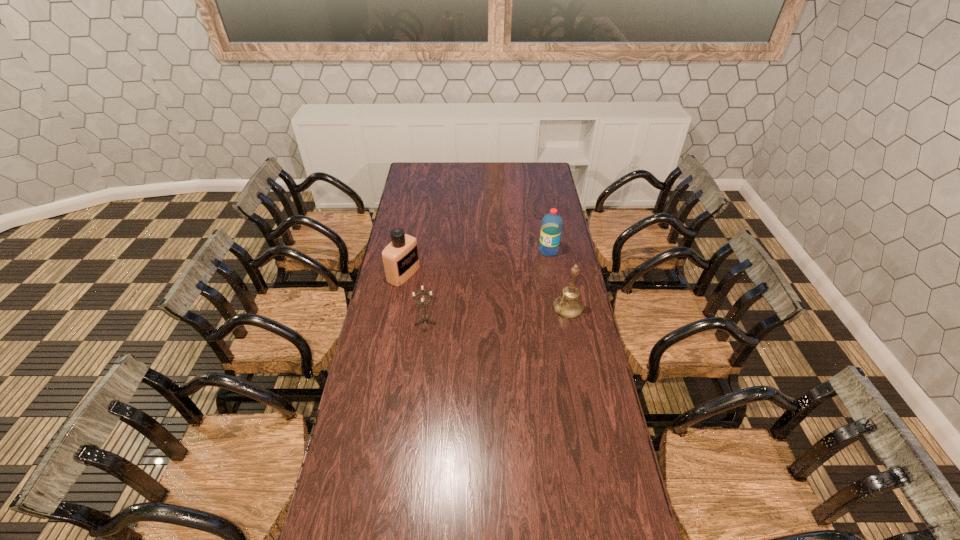
Where is `free space located on the front label of the farthest object`? free space located on the front label of the farthest object is located at coordinates (521, 277).

Identify the location of vacant area situated 0.330m on the front label of the perfume. (478, 308).

This screenshot has height=540, width=960. I want to click on vacant region located on the front label of the perfume, so click(454, 298).

Find the location of `vacant space situated on the front label of the perfume`. vacant space situated on the front label of the perfume is located at coordinates (476, 307).

In order to click on object that is at the left edge in this screenshot , I will do `click(400, 258)`.

The height and width of the screenshot is (540, 960). In order to click on bell at the right edge in this screenshot , I will do `click(568, 305)`.

Locate an element on the screen. The width and height of the screenshot is (960, 540). water bottle at the right edge is located at coordinates (551, 227).

You are a GUI agent. You are given a task and a screenshot of the screen. Output one action in this format:
    pyautogui.click(x=<x>, y=<y>)
    Task: Click on the vacant area at the far edge of the desktop
    
    Given the screenshot: What is the action you would take?
    pyautogui.click(x=470, y=167)

Locate an element on the screen. The width and height of the screenshot is (960, 540). free space at the near edge of the desktop is located at coordinates (518, 506).

In the image, there is a desktop. Find the location of `vacant space at the left edge`. vacant space at the left edge is located at coordinates (389, 338).